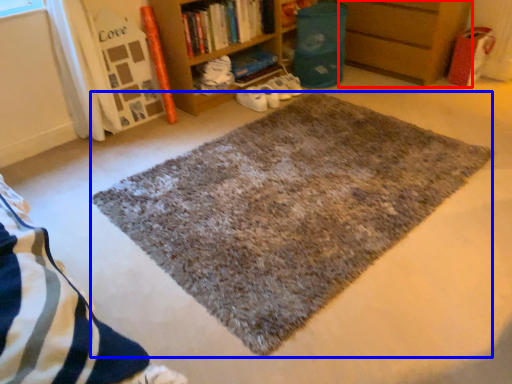
Question: Which of the following is the closest to the observer, shelf (highlighted by a red box) or mat (highlighted by a blue box)?

Choices:
 (A) shelf
 (B) mat

Answer: (B)